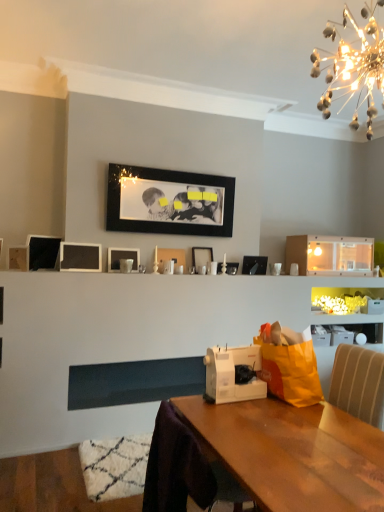
What is the approximate height of matte black picture frame at upper left, the 1th picture frame when ordered from left to right?

matte black picture frame at upper left, the 1th picture frame when ordered from left to right, is 12.84 inches in height.

The height and width of the screenshot is (512, 384). Describe the element at coordinates (330, 255) in the screenshot. I see `white glossy cabinet at upper center` at that location.

Locate an element on the screen. The height and width of the screenshot is (512, 384). orange fabric shopping bag at right is located at coordinates (289, 364).

Describe the element at coordinates (289, 364) in the screenshot. The image size is (384, 512). I see `orange fabric shopping bag at right` at that location.

I want to click on matte black picture frame at center, which ranks as the 3th picture frame in right-to-left order, so click(x=201, y=256).

From the image's perspective, which one is positioned higher, brown fabric swivel chair at lower right or matte black picture frame at upper center, the seventh picture frame when ordered from right to left?

matte black picture frame at upper center, the seventh picture frame when ordered from right to left, from the image's perspective.

From a real-world perspective, who is located lower, brown fabric swivel chair at lower right or matte black picture frame at upper center, the seventh picture frame when ordered from right to left?

In real-world perspective, brown fabric swivel chair at lower right is lower.

Which of these two, brown fabric swivel chair at lower right or matte black picture frame at upper center, marked as the 2th picture frame in a left-to-right arrangement, stands taller?

brown fabric swivel chair at lower right is taller.

Are brown fabric swivel chair at lower right and matte black picture frame at upper center, marked as the 2th picture frame in a left-to-right arrangement, located far from each other?

Yes, brown fabric swivel chair at lower right and matte black picture frame at upper center, marked as the 2th picture frame in a left-to-right arrangement, are located far from each other.

Is orange fabric shopping bag at right positioned with its back to white glossy cabinet at upper center?

That's not correct — orange fabric shopping bag at right is not looking away from white glossy cabinet at upper center.

Is orange fabric shopping bag at right taller than white glossy cabinet at upper center?

Indeed, orange fabric shopping bag at right has a greater height compared to white glossy cabinet at upper center.

From the image's perspective, relative to white glossy cabinet at upper center, is orange fabric shopping bag at right above or below?

Based on their image positions, orange fabric shopping bag at right is located beneath white glossy cabinet at upper center.

From a real-world perspective, who is located higher, orange fabric shopping bag at right or white glossy cabinet at upper center?

In real-world perspective, white glossy cabinet at upper center is above.

In the scene shown: Which object is more forward, brown fabric swivel chair at lower right or white glossy cabinet at upper center?

Positioned in front is brown fabric swivel chair at lower right.

Considering the sizes of objects brown fabric swivel chair at lower right and white glossy cabinet at upper center in the image provided, who is thinner, brown fabric swivel chair at lower right or white glossy cabinet at upper center?

white glossy cabinet at upper center.

Considering the relative positions of brown fabric swivel chair at lower right and white glossy cabinet at upper center in the image provided, is brown fabric swivel chair at lower right to the left of white glossy cabinet at upper center from the viewer's perspective?

Yes, brown fabric swivel chair at lower right is to the left of white glossy cabinet at upper center.

Considering the sizes of brown fabric swivel chair at lower right and white glossy cabinet at upper center in the image, is brown fabric swivel chair at lower right taller or shorter than white glossy cabinet at upper center?

brown fabric swivel chair at lower right is taller than white glossy cabinet at upper center.

Does matte black picture frame at upper left, acting as the eighth picture frame starting from the right, have a lesser width compared to white plastic sewing machine at center?

Yes, matte black picture frame at upper left, acting as the eighth picture frame starting from the right, is thinner than white plastic sewing machine at center.

Between matte black picture frame at upper left, the 1th picture frame when ordered from left to right, and white plastic sewing machine at center, which one appears on the right side from the viewer's perspective?

white plastic sewing machine at center.

Considering their positions, is matte black picture frame at upper left, acting as the eighth picture frame starting from the right, located in front of or behind white plastic sewing machine at center?

Clearly, matte black picture frame at upper left, acting as the eighth picture frame starting from the right, is behind white plastic sewing machine at center.

From the image's perspective, is matte black picture frame at upper left, acting as the eighth picture frame starting from the right, located above white plastic sewing machine at center?

Yes.

From a real-world perspective, is matte black picture frame at upper center, the seventh picture frame when ordered from right to left, beneath black matte picture frame at upper center, the 5th picture frame viewed from the left?

Yes, from a real-world perspective, matte black picture frame at upper center, the seventh picture frame when ordered from right to left, is below black matte picture frame at upper center, the 5th picture frame viewed from the left.

Measure the distance between matte black picture frame at upper center, marked as the 2th picture frame in a left-to-right arrangement, and black matte picture frame at upper center, which appears as the 4th picture frame when viewed from the right.

A distance of 27.56 inches exists between matte black picture frame at upper center, marked as the 2th picture frame in a left-to-right arrangement, and black matte picture frame at upper center, which appears as the 4th picture frame when viewed from the right.

Is matte black picture frame at upper center, the seventh picture frame when ordered from right to left, wider or thinner than black matte picture frame at upper center, the 5th picture frame viewed from the left?

Clearly, matte black picture frame at upper center, the seventh picture frame when ordered from right to left, has more width compared to black matte picture frame at upper center, the 5th picture frame viewed from the left.

Is matte black picture frame at upper center, marked as the 2th picture frame in a left-to-right arrangement, placed right next to black matte picture frame at upper center, the 5th picture frame viewed from the left?

No.

Is white plastic sewing machine at center bigger or smaller than matte black picture frame at upper center, the seventh picture frame when ordered from right to left?

white plastic sewing machine at center is bigger than matte black picture frame at upper center, the seventh picture frame when ordered from right to left.

Can you tell me how much white plastic sewing machine at center and matte black picture frame at upper center, marked as the 2th picture frame in a left-to-right arrangement, differ in facing direction?

white plastic sewing machine at center and matte black picture frame at upper center, marked as the 2th picture frame in a left-to-right arrangement, are facing 180 degrees away from each other.

From the image's perspective, is white plastic sewing machine at center positioned above or below matte black picture frame at upper center, marked as the 2th picture frame in a left-to-right arrangement?

Clearly, from the image's perspective, white plastic sewing machine at center is below matte black picture frame at upper center, marked as the 2th picture frame in a left-to-right arrangement.

Can you tell me how much white glossy cabinet at upper center and orange fabric shopping bag at right differ in facing direction?

The facing directions of white glossy cabinet at upper center and orange fabric shopping bag at right are 8.86 degrees apart.

From the image's perspective, which one is positioned higher, white glossy cabinet at upper center or orange fabric shopping bag at right?

white glossy cabinet at upper center, from the image's perspective.

Is white glossy cabinet at upper center behind orange fabric shopping bag at right?

Yes, it is.

Does white glossy cabinet at upper center have a smaller size compared to orange fabric shopping bag at right?

No, white glossy cabinet at upper center is not smaller than orange fabric shopping bag at right.

Locate an element on the screen. The image size is (384, 512). swivel chair on the right of matte black picture frame at upper center, the seventh picture frame when ordered from right to left is located at coordinates [x=183, y=469].

Identify the location of cabinetry above the orange fabric shopping bag at right (from the image's perspective). (330, 255).

When comparing their distances from white matte picture frame at center, the 3th picture frame from the left, does metallic silver picture frame at center, which ranks as the second picture frame in right-to-left order, or orange fabric shopping bag at right seem further?

orange fabric shopping bag at right is positioned further to the anchor white matte picture frame at center, the 3th picture frame from the left.

When comparing their distances from brown fabric swivel chair at lower right, does white glossy cabinet at upper center or white glossy picture frame at center, acting as the fifth picture frame starting from the right, seem further?

The object further to brown fabric swivel chair at lower right is white glossy cabinet at upper center.

Which object lies further to the anchor point brown fabric swivel chair at lower right, metallic silver picture frame at center, which ranks as the second picture frame in right-to-left order, or white glossy picture frame at center, acting as the fifth picture frame starting from the right?

metallic silver picture frame at center, which ranks as the second picture frame in right-to-left order.

Which object lies nearer to the anchor point white glossy picture frame at center, which is the fourth picture frame in left-to-right order, illuminated glass chandelier at upper right or matte black picture frame at upper center, the seventh picture frame when ordered from right to left?

Among the two, matte black picture frame at upper center, the seventh picture frame when ordered from right to left, is located nearer to white glossy picture frame at center, which is the fourth picture frame in left-to-right order.

Estimate the real-world distances between objects in this image. Which object is closer to illuminated glass chandelier at upper right, brown fabric swivel chair at lower right or white matte picture frame at center, which is counted as the sixth picture frame, starting from the right?

brown fabric swivel chair at lower right lies closer to illuminated glass chandelier at upper right than the other object.

Based on their spatial positions, is white plastic sewing machine at center or matte black picture frame at upper center, marked as the 2th picture frame in a left-to-right arrangement, further from matte black picture frame at upper left, the 1th picture frame when ordered from left to right?

white plastic sewing machine at center is positioned further to the anchor matte black picture frame at upper left, the 1th picture frame when ordered from left to right.

Which object lies further to the anchor point orange fabric shopping bag at right, white glossy picture frame at center, which is the fourth picture frame in left-to-right order, or metallic silver picture frame at center, which ranks as the second picture frame in right-to-left order?

The object further to orange fabric shopping bag at right is metallic silver picture frame at center, which ranks as the second picture frame in right-to-left order.

Looking at the image, which one is located closer to white glossy picture frame at center, which is the fourth picture frame in left-to-right order, white glossy cabinet at upper center or metallic silver picture frame at center, which ranks as the 8th picture frame in left-to-right order?

metallic silver picture frame at center, which ranks as the 8th picture frame in left-to-right order, is closer to white glossy picture frame at center, which is the fourth picture frame in left-to-right order.

You are a GUI agent. You are given a task and a screenshot of the screen. Output one action in this format:
    pyautogui.click(x=<x>, y=<y>)
    Task: Click on the shopping bag between brown fabric swivel chair at lower right and metallic silver picture frame at center, the 7th picture frame positioned from the left, along the z-axis
    Image resolution: width=384 pixels, height=512 pixels.
    Given the screenshot: What is the action you would take?
    pyautogui.click(x=289, y=364)

At what (x,y) coordinates should I click in order to perform the action: click on shopping bag between matte black picture frame at upper left, acting as the eighth picture frame starting from the right, and metallic silver picture frame at center, positioned as the first picture frame in right-to-left order, from left to right. Please return your answer as a coordinate pair (x, y). Looking at the image, I should click on (289, 364).

Find the location of `shopping bag between brown fabric swivel chair at lower right and matte black picture frame at upper center, marked as the 2th picture frame in a left-to-right arrangement, from front to back`. shopping bag between brown fabric swivel chair at lower right and matte black picture frame at upper center, marked as the 2th picture frame in a left-to-right arrangement, from front to back is located at coordinates (289, 364).

Identify the location of shopping bag positioned between illuminated glass chandelier at upper right and matte black picture frame at upper center, marked as the 2th picture frame in a left-to-right arrangement, from near to far. The image size is (384, 512). (289, 364).